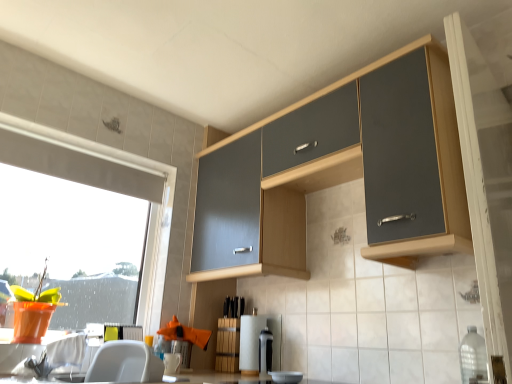
Question: Is matte wood screen door at upper right further to camera compared to matte gray cabinet at upper center?

Choices:
 (A) no
 (B) yes

Answer: (A)

Question: Can you see matte wood screen door at upper right touching matte gray cabinet at upper center?

Choices:
 (A) yes
 (B) no

Answer: (B)

Question: Is matte wood screen door at upper right shorter than matte gray cabinet at upper center?

Choices:
 (A) no
 (B) yes

Answer: (A)

Question: Is matte wood screen door at upper right not near matte gray cabinet at upper center?

Choices:
 (A) yes
 (B) no

Answer: (B)

Question: Does matte wood screen door at upper right have a larger size compared to matte gray cabinet at upper center?

Choices:
 (A) yes
 (B) no

Answer: (B)

Question: From a real-world perspective, relative to clear plastic bottle at lower right, is satin black coffee maker at lower center, the second appliance from the left, vertically above or below?

Choices:
 (A) above
 (B) below

Answer: (B)

Question: Is point (263, 365) closer or farther from the camera than point (480, 370)?

Choices:
 (A) closer
 (B) farther

Answer: (B)

Question: Considering the positions of satin black coffee maker at lower center, which is counted as the 1th appliance, starting from the right, and clear plastic bottle at lower right in the image, is satin black coffee maker at lower center, which is counted as the 1th appliance, starting from the right, bigger or smaller than clear plastic bottle at lower right?

Choices:
 (A) big
 (B) small

Answer: (B)

Question: From their relative heights in the image, would you say satin black coffee maker at lower center, which is counted as the 1th appliance, starting from the right, is taller or shorter than clear plastic bottle at lower right?

Choices:
 (A) short
 (B) tall

Answer: (A)

Question: From a real-world perspective, is white paper towel at center, the 2th appliance when ordered from right to left, positioned above or below matte wood screen door at upper right?

Choices:
 (A) above
 (B) below

Answer: (B)

Question: Is point (249, 359) closer or farther from the camera than point (470, 155)?

Choices:
 (A) closer
 (B) farther

Answer: (B)

Question: In terms of size, does white paper towel at center, the first appliance in the left-to-right sequence, appear bigger or smaller than matte wood screen door at upper right?

Choices:
 (A) big
 (B) small

Answer: (B)

Question: From their relative heights in the image, would you say white paper towel at center, the first appliance in the left-to-right sequence, is taller or shorter than matte wood screen door at upper right?

Choices:
 (A) short
 (B) tall

Answer: (A)

Question: From the image's perspective, is white paper towel at center, the first appliance in the left-to-right sequence, located above or below transparent glass window at left?

Choices:
 (A) above
 (B) below

Answer: (B)

Question: Considering the positions of white paper towel at center, the first appliance in the left-to-right sequence, and transparent glass window at left in the image, is white paper towel at center, the first appliance in the left-to-right sequence, taller or shorter than transparent glass window at left?

Choices:
 (A) tall
 (B) short

Answer: (B)